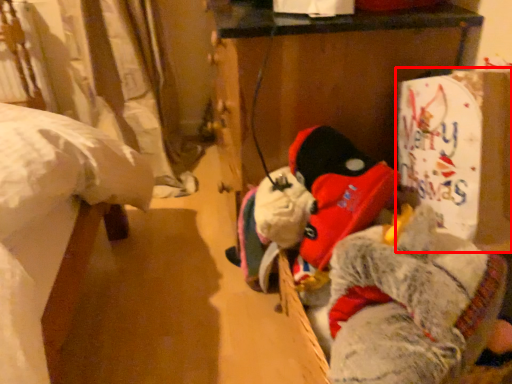
Question: Considering the relative positions of cardboard box (annotated by the red box) and animal in the image provided, where is cardboard box (annotated by the red box) located with respect to the staircase?

Choices:
 (A) left
 (B) right

Answer: (B)